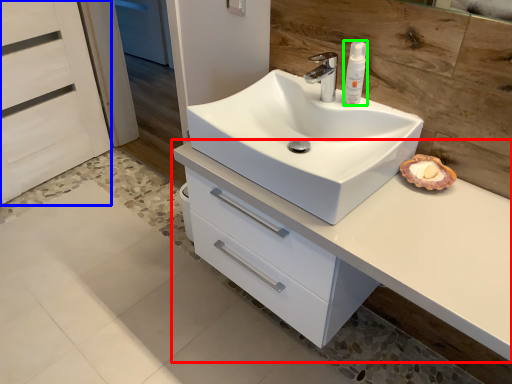
Question: Which is farther away from bathroom cabinet (highlighted by a red box)? screen door (highlighted by a blue box) or toiletry (highlighted by a green box)?

Choices:
 (A) screen door
 (B) toiletry

Answer: (A)